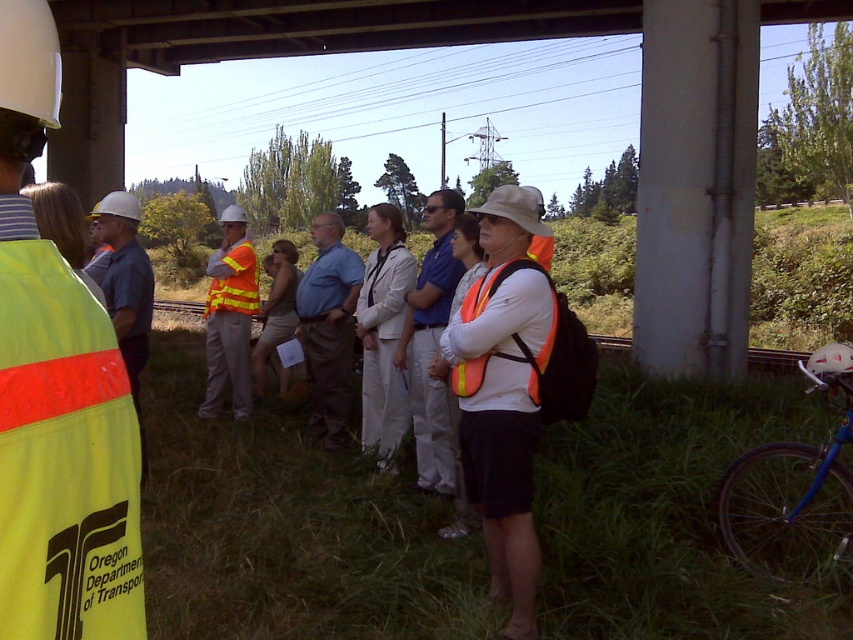
Is point (225, 60) positioned behind point (444, 269)?

Yes, it is behind point (444, 269).

Does brushed metal overpass at upper center have a greater width compared to matte orange vest at center?

Correct, the width of brushed metal overpass at upper center exceeds that of matte orange vest at center.

This screenshot has width=853, height=640. Find the location of `brushed metal overpass at upper center`. brushed metal overpass at upper center is located at coordinates (318, 26).

The width and height of the screenshot is (853, 640). What are the coordinates of `brushed metal overpass at upper center` in the screenshot? It's located at (318, 26).

Between point (317, 262) and point (235, 264), which one is positioned in front?

Point (317, 262) is in front.

Locate an element on the screen. Image resolution: width=853 pixels, height=640 pixels. blue fabric shirt at center is located at coordinates pos(328,326).

Between reflective orange safety vest at center and hi-visibility reflective safety vest at center, which one appears on the left side from the viewer's perspective?

Positioned to the left is reflective orange safety vest at center.

Does reflective orange safety vest at center have a smaller size compared to hi-visibility reflective safety vest at center?

No, reflective orange safety vest at center is not smaller than hi-visibility reflective safety vest at center.

The image size is (853, 640). I want to click on reflective orange safety vest at center, so click(x=230, y=317).

Identify the location of reflective orange safety vest at center. The height and width of the screenshot is (640, 853). (230, 317).